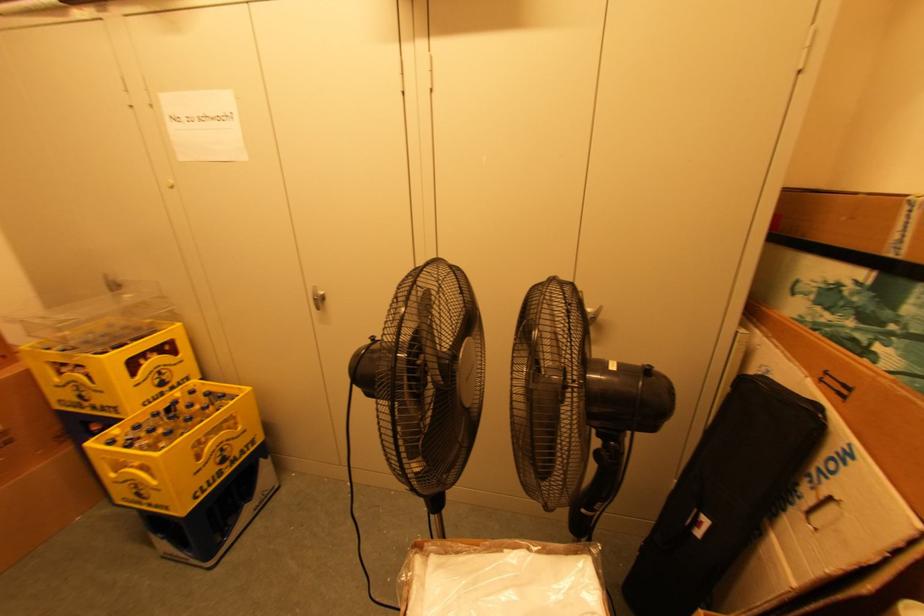
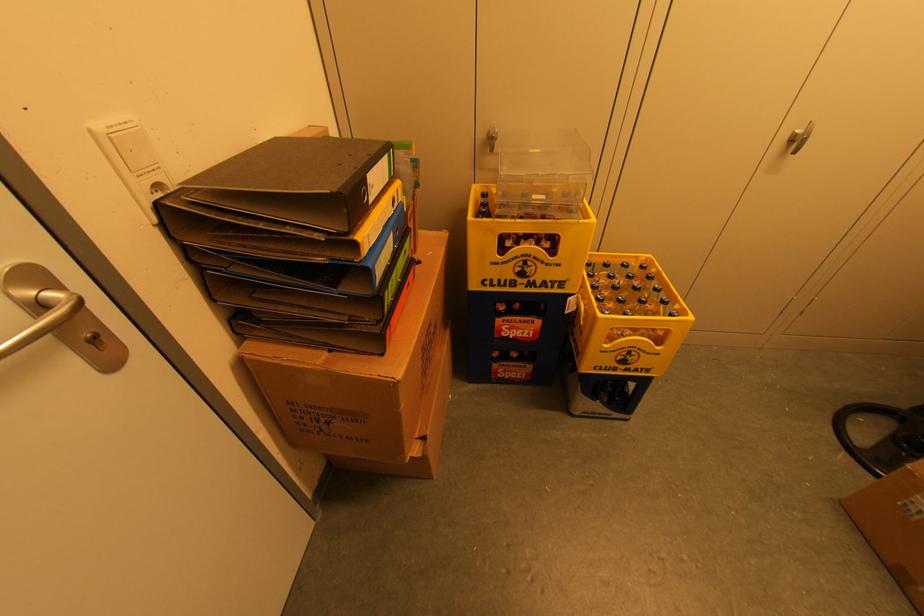
Locate, in the second image, the point that corresponds to pixel 159 507 in the first image.

(638, 370)